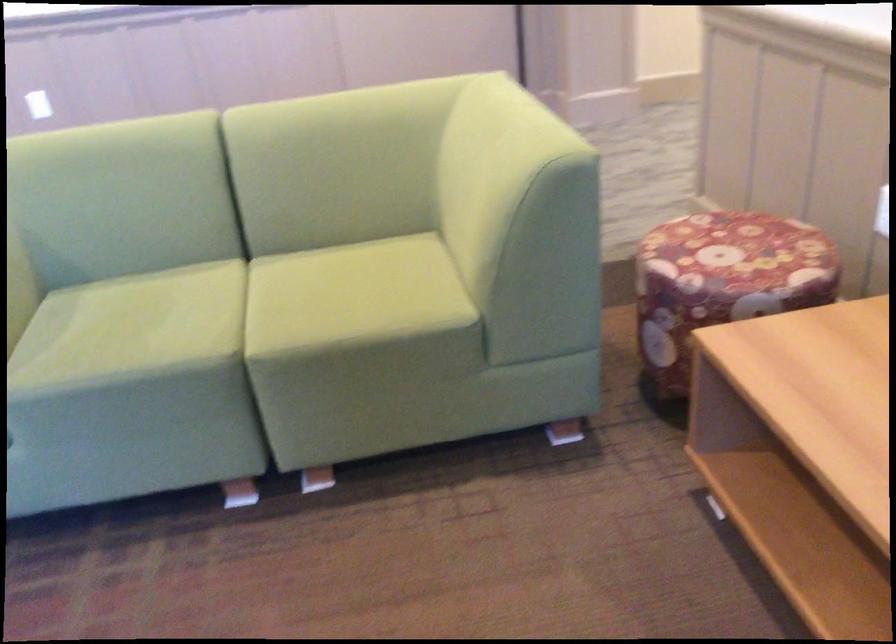
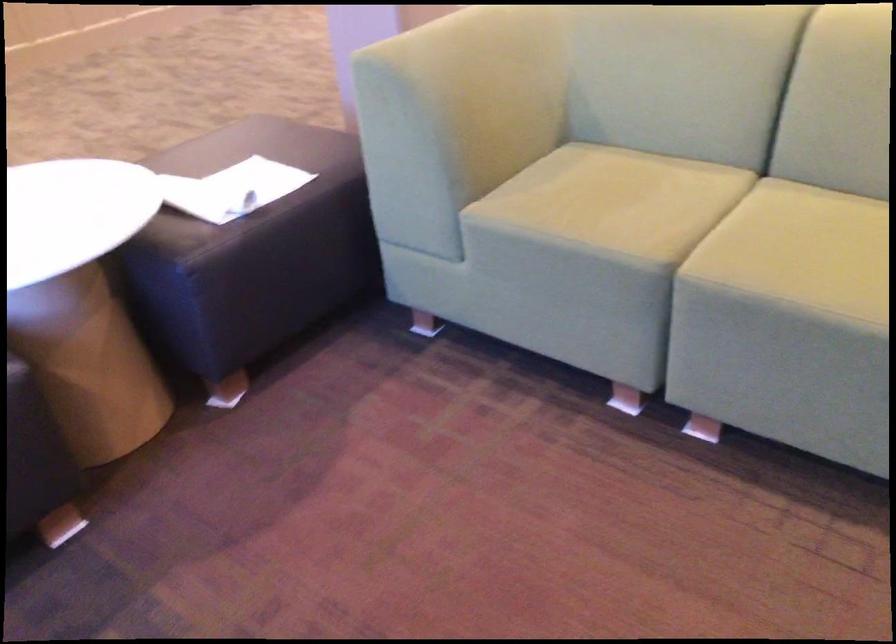
In the second image, find the point that corresponds to point (167, 319) in the first image.

(636, 202)